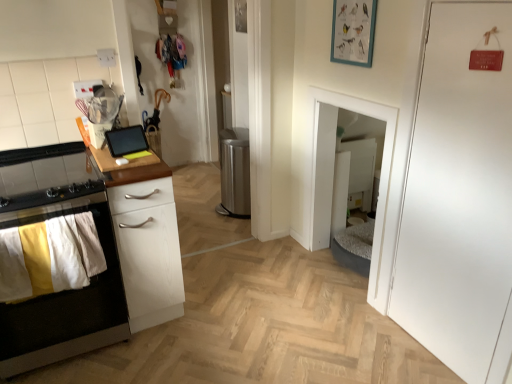
Question: Is point click(x=229, y=162) closer or farther from the camera than point click(x=39, y=261)?

Choices:
 (A) farther
 (B) closer

Answer: (A)

Question: Considering their positions, is stainless steel trash can at center, which is the 2th appliance from front to back, located in front of or behind yellow and white fabric at left?

Choices:
 (A) front
 (B) behind

Answer: (B)

Question: Which is farther from the matte black tablet at upper left, which ranks as the 1th appliance in left-to-right order?

Choices:
 (A) yellow and white fabric at left
 (B) white wood chest of drawers at left
 (C) white matte door at right
 (D) stainless steel trash can at center, which is the 2th appliance from front to back
 (E) teal matte picture frame at upper center

Answer: (C)

Question: Considering the real-world distances, which object is farthest from the white matte cabinet at left?

Choices:
 (A) white wood chest of drawers at left
 (B) matte black tablet at upper left, the 2th appliance viewed from the right
 (C) teal matte picture frame at upper center
 (D) yellow and white fabric at left
 (E) stainless steel trash can at center, which is the 2th appliance from front to back

Answer: (C)